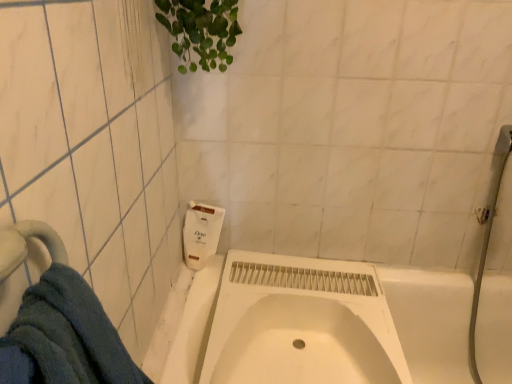
Image resolution: width=512 pixels, height=384 pixels. In order to click on free space to the right of white matte soap dispenser at upper center in this screenshot , I will do `click(250, 269)`.